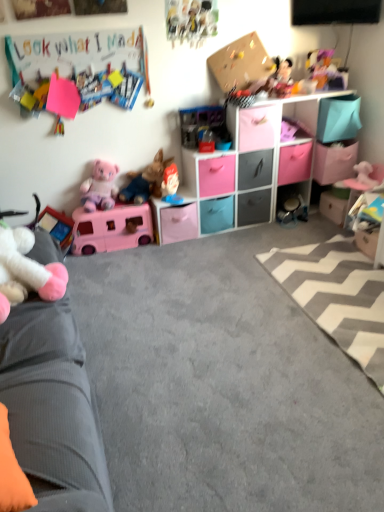
What do you see at coordinates (12, 473) in the screenshot? Image resolution: width=384 pixels, height=512 pixels. I see `orange fabric pillow at lower left` at bounding box center [12, 473].

I want to click on shiny plastic doll at upper right, which is the 3th toy in right-to-left order, so click(280, 79).

I want to click on matte pink plastic camper at lower left, the third toy in the left-to-right sequence, so click(111, 229).

The height and width of the screenshot is (512, 384). What do you see at coordinates (111, 229) in the screenshot?
I see `matte pink plastic camper at lower left, the third toy in the left-to-right sequence` at bounding box center [111, 229].

The height and width of the screenshot is (512, 384). What are the coordinates of `pink plastic drawer at center, marked as the 7th drawer in a right-to-left arrangement` in the screenshot? It's located at (178, 223).

Measure the distance between matte plastic figurine at center, the fifth toy viewed from the right, and camera.

The distance of matte plastic figurine at center, the fifth toy viewed from the right, from camera is 2.88 meters.

How much space does gray matte drawer at center, marked as the sixth drawer in a left-to-right arrangement, occupy vertically?

It is 10.72 inches.

The height and width of the screenshot is (512, 384). In order to click on orange fabric pillow at lower left in this screenshot , I will do `click(12, 473)`.

Is pink plastic drawer at center, marked as the 7th drawer in a right-to-left arrangement, shorter than matte plastic storage unit at upper center?

Indeed, pink plastic drawer at center, marked as the 7th drawer in a right-to-left arrangement, has a lesser height compared to matte plastic storage unit at upper center.

Looking at their sizes, would you say pink plastic drawer at center, marked as the 7th drawer in a right-to-left arrangement, is wider or thinner than matte plastic storage unit at upper center?

Considering their sizes, pink plastic drawer at center, marked as the 7th drawer in a right-to-left arrangement, looks broader than matte plastic storage unit at upper center.

Is pink plastic drawer at center, marked as the 7th drawer in a right-to-left arrangement, facing away from matte plastic storage unit at upper center?

Correct, pink plastic drawer at center, marked as the 7th drawer in a right-to-left arrangement, is looking away from matte plastic storage unit at upper center.

Is pink plastic drawer at center, which appears as the first drawer when viewed from the left, spatially inside matte plastic storage unit at upper center, or outside of it?

pink plastic drawer at center, which appears as the first drawer when viewed from the left, fits inside matte plastic storage unit at upper center.

From a real-world perspective, which object stands above the other?

pink matte drawer at center, the 4th drawer viewed from the left, from a real-world perspective.

Which object is further away from the camera, white glossy drawer at lower right, placed as the 1th drawer when sorted from right to left, or pink matte drawer at center, the 4th drawer viewed from the right?

white glossy drawer at lower right, placed as the 1th drawer when sorted from right to left, is behind.

Could you tell me if white glossy drawer at lower right, the 7th drawer from the left, is turned towards pink matte drawer at center, the 4th drawer viewed from the left?

No, white glossy drawer at lower right, the 7th drawer from the left, is not aimed at pink matte drawer at center, the 4th drawer viewed from the left.

From a real-world perspective, is cartoonish paper poster at upper center, which is counted as the sixth toy, starting from the left, beneath matte plastic figurine at center, the 5th toy viewed from the left?

Incorrect, from a real-world perspective, cartoonish paper poster at upper center, which is counted as the sixth toy, starting from the left, is higher than matte plastic figurine at center, the 5th toy viewed from the left.

Which is closer to the camera, (199, 35) or (173, 199)?

The point (199, 35) is closer to the camera.

In the image, is cartoonish paper poster at upper center, which is counted as the sixth toy, starting from the left, on the left side or the right side of matte plastic figurine at center, the fifth toy viewed from the right?

cartoonish paper poster at upper center, which is counted as the sixth toy, starting from the left, is to the right of matte plastic figurine at center, the fifth toy viewed from the right.

How different are the orientations of shiny plastic doll at upper right, which is the 3th toy in right-to-left order, and matte pink plastic camper at lower left, the 7th toy viewed from the right, in degrees?

They differ by 0.000313 degrees in their facing directions.

From a real-world perspective, between shiny plastic doll at upper right, which is the 3th toy in right-to-left order, and matte pink plastic camper at lower left, the 7th toy viewed from the right, who is vertically lower?

matte pink plastic camper at lower left, the 7th toy viewed from the right, is physically lower.

Is point (289, 74) positioned in front of point (117, 205)?

No, (289, 74) is further to viewer.

Is shiny plastic doll at upper right, which is the 3th toy in right-to-left order, facing away from matte pink plastic camper at lower left, the 7th toy viewed from the right?

No, matte pink plastic camper at lower left, the 7th toy viewed from the right, is not at the back of shiny plastic doll at upper right, which is the 3th toy in right-to-left order.

Is shiny plastic doll at upper right, the 7th toy when ordered from left to right, positioned far away from pink plush bear at right, which appears as the 9th toy when viewed from the left?

That's not correct — shiny plastic doll at upper right, the 7th toy when ordered from left to right, is a little close to pink plush bear at right, which appears as the 9th toy when viewed from the left.

Who is bigger, shiny plastic doll at upper right, which is the 3th toy in right-to-left order, or pink plush bear at right, which ranks as the 1th toy in right-to-left order?

shiny plastic doll at upper right, which is the 3th toy in right-to-left order.

Does cardboard bulletin board at upper left have a lesser width compared to white glossy drawer at lower right, placed as the 1th drawer when sorted from right to left?

Yes, cardboard bulletin board at upper left is thinner than white glossy drawer at lower right, placed as the 1th drawer when sorted from right to left.

From the image's perspective, between cardboard bulletin board at upper left and white glossy drawer at lower right, the 7th drawer from the left, who is located below?

white glossy drawer at lower right, the 7th drawer from the left, from the image's perspective.

Does cardboard bulletin board at upper left have a smaller size compared to white glossy drawer at lower right, placed as the 1th drawer when sorted from right to left?

Correct, cardboard bulletin board at upper left occupies less space than white glossy drawer at lower right, placed as the 1th drawer when sorted from right to left.

Is gray matte drawer at center, marked as the sixth drawer in a left-to-right arrangement, placed right next to blue matte drawer at center, acting as the third drawer starting from the left?

Answer: No, gray matte drawer at center, marked as the sixth drawer in a left-to-right arrangement, is not beside blue matte drawer at center, acting as the third drawer starting from the left.

Considering the relative positions of gray matte drawer at center, placed as the 2th drawer when sorted from right to left, and blue matte drawer at center, acting as the third drawer starting from the left, in the image provided, is gray matte drawer at center, placed as the 2th drawer when sorted from right to left, to the left or to the right of blue matte drawer at center, acting as the third drawer starting from the left,?

Based on their positions, gray matte drawer at center, placed as the 2th drawer when sorted from right to left, is located to the right of blue matte drawer at center, acting as the third drawer starting from the left.

Is gray matte drawer at center, placed as the 2th drawer when sorted from right to left, turned away from blue matte drawer at center, arranged as the fifth drawer when viewed from the right?

No, gray matte drawer at center, placed as the 2th drawer when sorted from right to left,'s orientation is not away from blue matte drawer at center, arranged as the fifth drawer when viewed from the right.

Which object is more forward, gray matte drawer at center, placed as the 2th drawer when sorted from right to left, or blue matte drawer at center, acting as the third drawer starting from the left?

blue matte drawer at center, acting as the third drawer starting from the left, is more forward.

Find the location of a particular element. The image size is (384, 512). the 4th drawer to the left of the matte plastic storage unit at upper center, starting your count from the anchor is located at coordinates (178, 223).

From the white glossy drawer at lower right, the 7th drawer from the left, count 6th drawers forward and point to it. Please provide its 2D coordinates.

[(257, 128)]

Based on their spatial positions, is plush mickey mouse at upper right, the 8th toy positioned from the left, or velvet grey couch at left further from pink plastic drawer at center, marked as the 7th drawer in a right-to-left arrangement?

The object further to pink plastic drawer at center, marked as the 7th drawer in a right-to-left arrangement, is velvet grey couch at left.

When comparing their distances from gray matte drawer at center, placed as the 2th drawer when sorted from right to left, does plush pink fabric teddy bear at left, arranged as the eighth toy when viewed from the right, or velvet grey couch at left seem closer?

The object closer to gray matte drawer at center, placed as the 2th drawer when sorted from right to left, is plush pink fabric teddy bear at left, arranged as the eighth toy when viewed from the right.

Looking at this image, based on their spatial positions, is cartoonish paper poster at upper center, which is counted as the sixth toy, starting from the left, or orange fabric pillow at lower left closer to gray matte drawer at center, placed as the 2th drawer when sorted from right to left?

Among the two, cartoonish paper poster at upper center, which is counted as the sixth toy, starting from the left, is located nearer to gray matte drawer at center, placed as the 2th drawer when sorted from right to left.

Based on their spatial positions, is cardboard bulletin board at upper left or white plush toy at left, which is the ninth toy in right-to-left order, further from gray/white zigzag rug at lower right?

cardboard bulletin board at upper left lies further to gray/white zigzag rug at lower right than the other object.

When comparing their distances from plush pink fabric teddy bear at left, which is the 2th toy in left-to-right order, does pink plush bear at right, which appears as the 9th toy when viewed from the left, or gray/white zigzag rug at lower right seem further?

pink plush bear at right, which appears as the 9th toy when viewed from the left, lies further to plush pink fabric teddy bear at left, which is the 2th toy in left-to-right order, than the other object.

From the image, which object appears to be nearer to plush pink fabric teddy bear at left, which is the 2th toy in left-to-right order, cartoonish paper poster at upper center, which is counted as the sixth toy, starting from the left, or plush mickey mouse at upper right, the 8th toy positioned from the left?

The object closer to plush pink fabric teddy bear at left, which is the 2th toy in left-to-right order, is cartoonish paper poster at upper center, which is counted as the sixth toy, starting from the left.

From the image, which object appears to be nearer to matte gray drawer at center, which is the 3th drawer from right to left, plush pink fabric teddy bear at left, which is the 2th toy in left-to-right order, or orange fabric pillow at lower left?

plush pink fabric teddy bear at left, which is the 2th toy in left-to-right order, is closer to matte gray drawer at center, which is the 3th drawer from right to left.

Estimate the real-world distances between objects in this image. Which object is further from plush pink fabric teddy bear at left, arranged as the eighth toy when viewed from the right, pink plastic drawer at center, which appears as the first drawer when viewed from the left, or brown plush toy at center, which is the sixth toy in right-to-left order?

Based on the image, pink plastic drawer at center, which appears as the first drawer when viewed from the left, appears to be further to plush pink fabric teddy bear at left, arranged as the eighth toy when viewed from the right.

Where is `entertainment center between plush pink fabric teddy bear at left, which is the 2th toy in left-to-right order, and plush mickey mouse at upper right, which appears as the 2th toy when viewed from the right, in the horizontal direction`? entertainment center between plush pink fabric teddy bear at left, which is the 2th toy in left-to-right order, and plush mickey mouse at upper right, which appears as the 2th toy when viewed from the right, in the horizontal direction is located at coordinates (265, 147).

Locate an element on the screen. pillow positioned between velvet grey couch at left and pink matte drawer at center, the 4th drawer viewed from the left, from near to far is located at coordinates (12, 473).

Where is `entertainment center between orange fabric pillow at lower left and plush pink fabric teddy bear at left, arranged as the eighth toy when viewed from the right, in the front-back direction`? This screenshot has width=384, height=512. entertainment center between orange fabric pillow at lower left and plush pink fabric teddy bear at left, arranged as the eighth toy when viewed from the right, in the front-back direction is located at coordinates (265, 147).

This screenshot has width=384, height=512. I want to click on drawer between plush mickey mouse at upper right, which appears as the 2th toy when viewed from the right, and matte plastic storage unit at upper center vertically, so click(x=257, y=128).